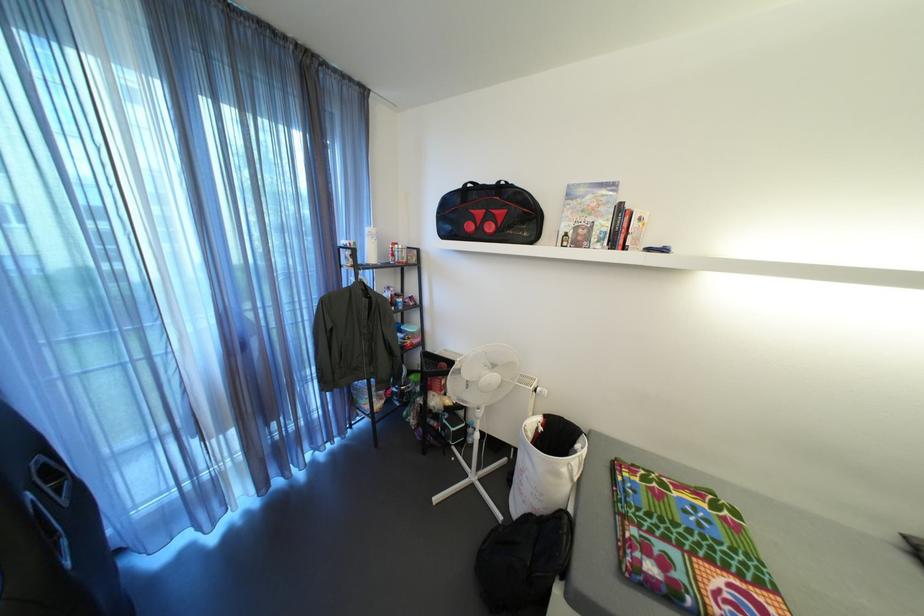
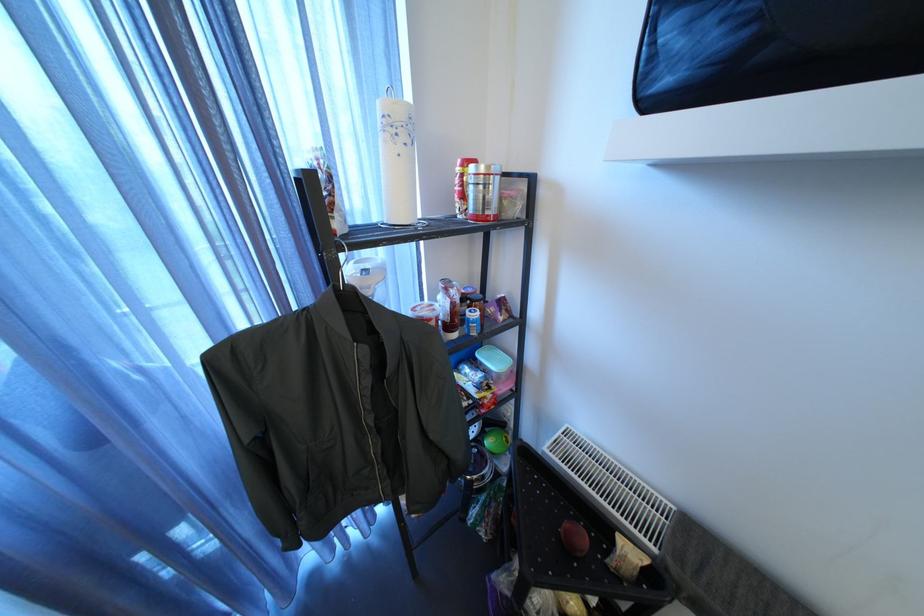
Question: Which direction would the cameraman need to move to produce the second image? Reply with the corresponding letter.

Choices:
 (A) Left
 (B) Right
 (C) Forward
 (D) Backward

Answer: (C)